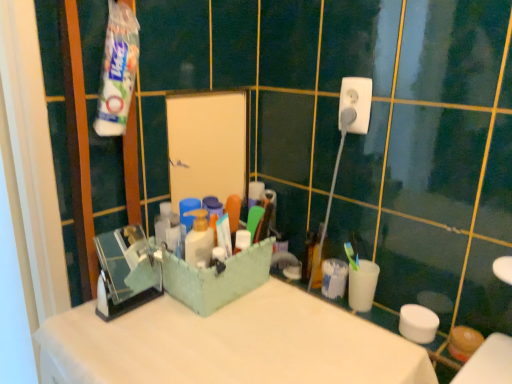
Question: Could white plastic cup at right be considered to be inside white plastic socket at upper right?

Choices:
 (A) yes
 (B) no

Answer: (B)

Question: Does white plastic socket at upper right lie behind white plastic cup at right?

Choices:
 (A) no
 (B) yes

Answer: (A)

Question: Is white plastic cup at right at the back of white plastic socket at upper right?

Choices:
 (A) yes
 (B) no

Answer: (B)

Question: Is white plastic socket at upper right positioned beyond the bounds of white plastic cup at right?

Choices:
 (A) no
 (B) yes

Answer: (B)

Question: Is white plastic socket at upper right oriented towards white plastic cup at right?

Choices:
 (A) yes
 (B) no

Answer: (B)

Question: From the image's perspective, is white plastic socket at upper right on white plastic cup at right?

Choices:
 (A) yes
 (B) no

Answer: (A)

Question: Is white plastic socket at upper right far away from white matte counter top at center?

Choices:
 (A) yes
 (B) no

Answer: (B)

Question: Considering the relative sizes of white plastic socket at upper right and white matte counter top at center in the image provided, is white plastic socket at upper right wider than white matte counter top at center?

Choices:
 (A) yes
 (B) no

Answer: (B)

Question: From a real-world perspective, does white plastic socket at upper right sit lower than white matte counter top at center?

Choices:
 (A) no
 (B) yes

Answer: (A)

Question: Does white plastic socket at upper right come behind white matte counter top at center?

Choices:
 (A) yes
 (B) no

Answer: (A)

Question: From a real-world perspective, is white plastic socket at upper right located higher than white matte counter top at center?

Choices:
 (A) yes
 (B) no

Answer: (A)

Question: From the image's perspective, would you say white plastic socket at upper right is positioned over white matte counter top at center?

Choices:
 (A) yes
 (B) no

Answer: (A)

Question: Does white matte counter top at center have a lesser height compared to white plastic socket at upper right?

Choices:
 (A) no
 (B) yes

Answer: (A)